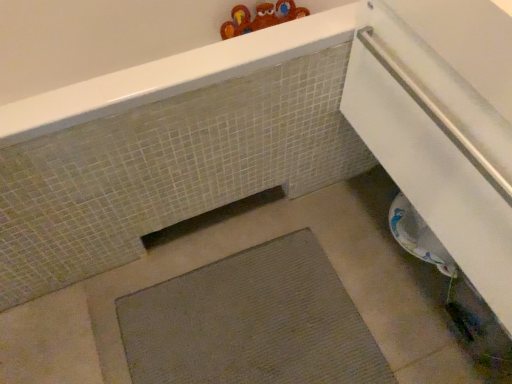
The image size is (512, 384). I want to click on free space above gray textured bath mat at center (from a real-world perspective), so click(x=253, y=324).